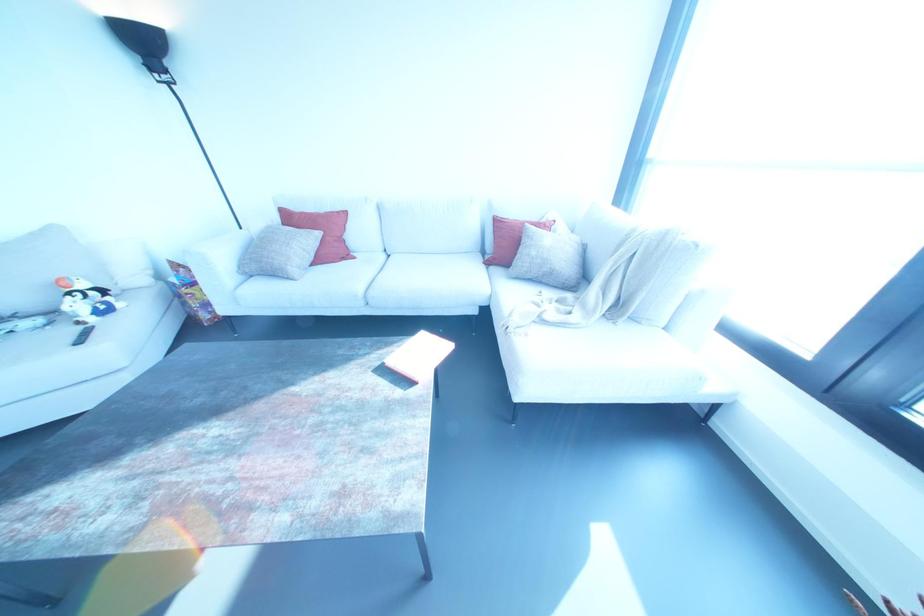
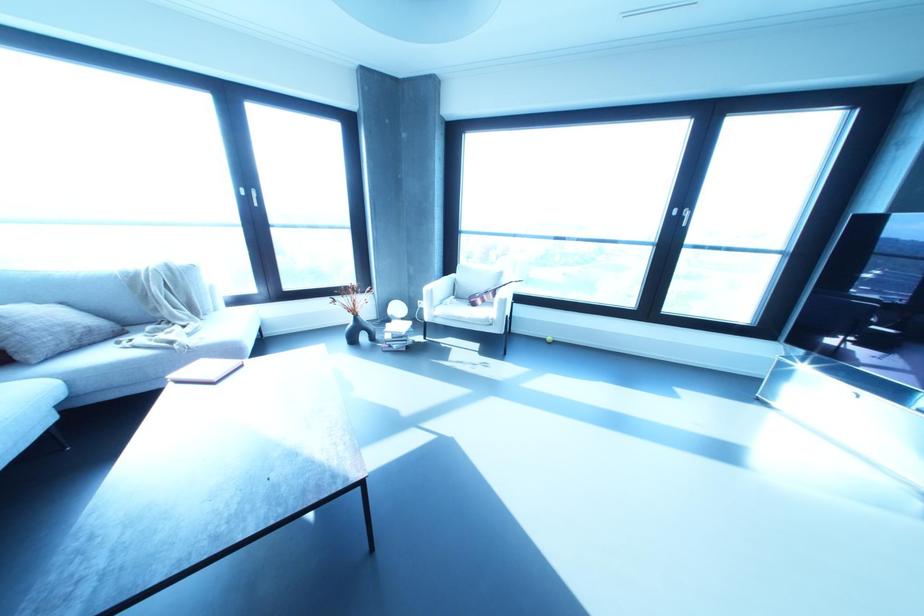
The point at (408,382) is marked in the first image. Where is the corresponding point in the second image?

(241, 365)